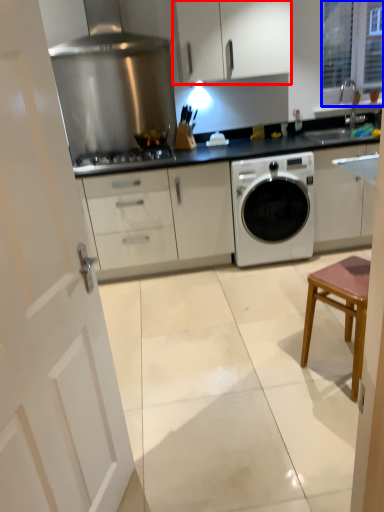
Question: Among these objects, which one is nearest to the camera, cabinetry (highlighted by a red box) or window (highlighted by a blue box)?

Choices:
 (A) cabinetry
 (B) window

Answer: (A)